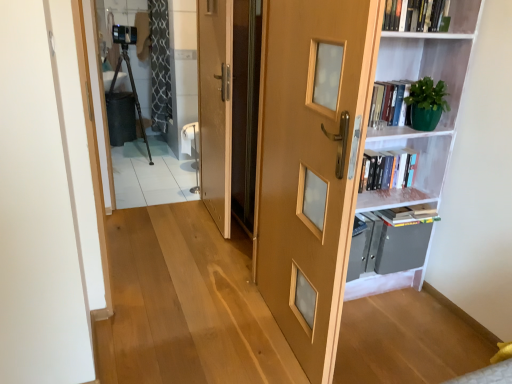
Where is `free space in front of wooden door at center, positioned as the 2th door in front-to-back order`? Image resolution: width=512 pixels, height=384 pixels. free space in front of wooden door at center, positioned as the 2th door in front-to-back order is located at coordinates point(193,249).